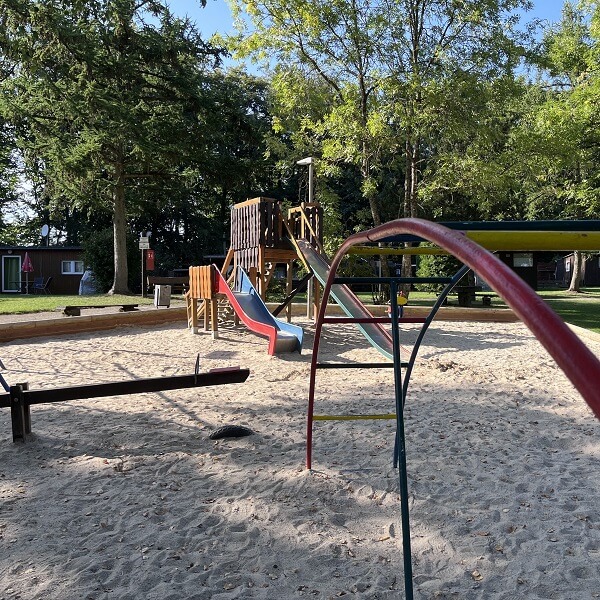
The height and width of the screenshot is (600, 600). What are the coordinates of `door` in the screenshot? It's located at (2, 272).